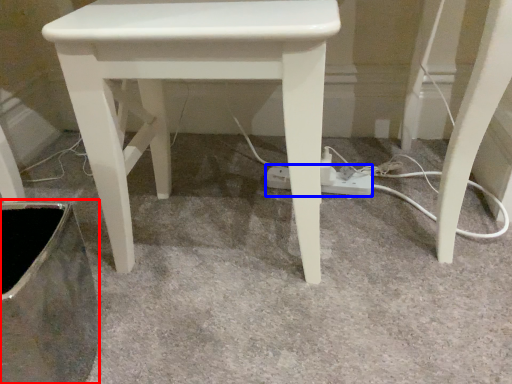
Question: Which point is further to the camera, swivel chair (highlighted by a red box) or extension cord (highlighted by a blue box)?

Choices:
 (A) swivel chair
 (B) extension cord

Answer: (B)